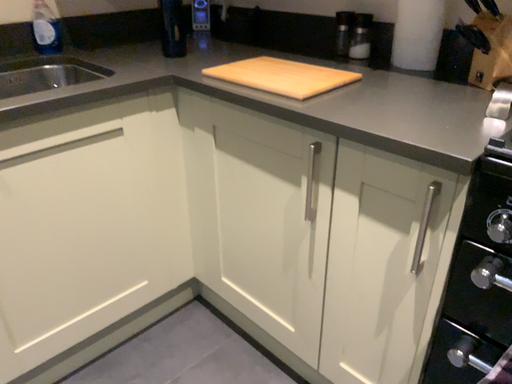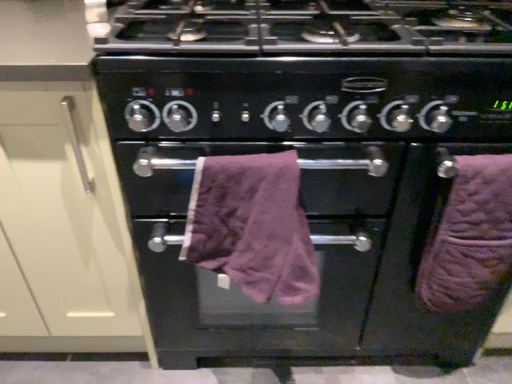
Question: How did the camera likely rotate when shooting the video?

Choices:
 (A) rotated left
 (B) rotated right

Answer: (B)